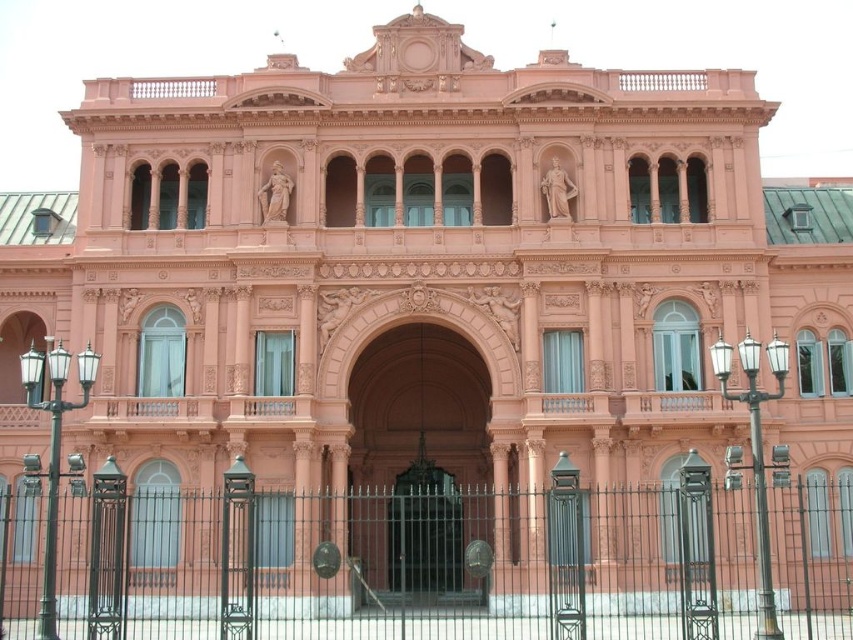
This screenshot has height=640, width=853. Describe the element at coordinates (505, 561) in the screenshot. I see `black wrought iron fence at center` at that location.

Is black wrought iron fence at center taller than polished bronze door at center?

Yes, black wrought iron fence at center is taller than polished bronze door at center.

Who is more forward, [805,612] or [421,493]?

Point [805,612] is more forward.

You are a GUI agent. You are given a task and a screenshot of the screen. Output one action in this format:
    pyautogui.click(x=<x>, y=<y>)
    Task: Click on the black wrought iron fence at center
    
    Given the screenshot: What is the action you would take?
    pyautogui.click(x=505, y=561)